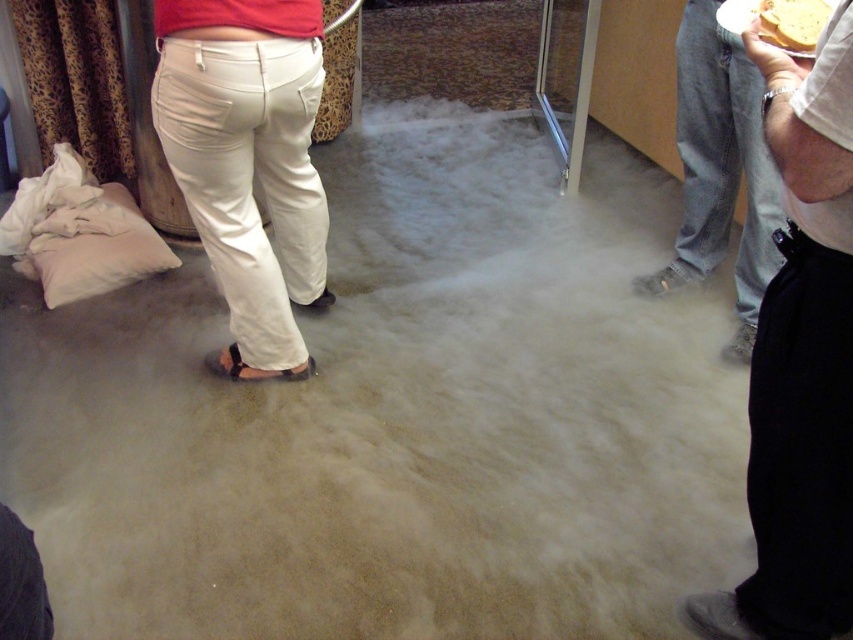
You are a photographer trying to capture a clear shot of the black smooth pants at right and the yellow bread at upper right. Which object should you focus on first to ensure both are in focus?

You should focus on the black smooth pants at right first since it is closer to the viewer than the yellow bread at upper right. By focusing on the closer object, the yellow bread at upper right will fall into the depth of field and remain sharp.

You are trying to locate the black smooth pants at right in the image. According to the coordinates provided, where exactly should you look?

The black smooth pants at right are located at point coordinates of (799,364).